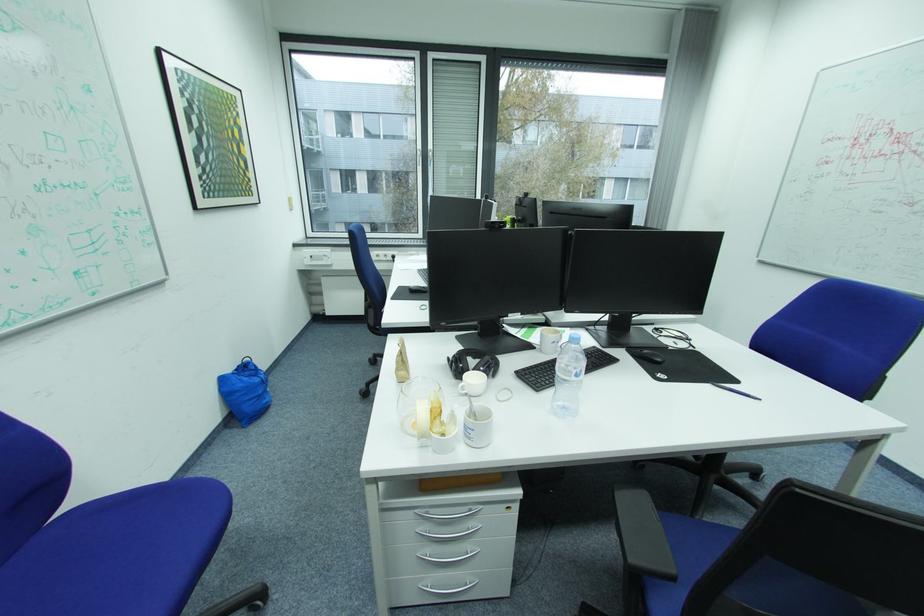
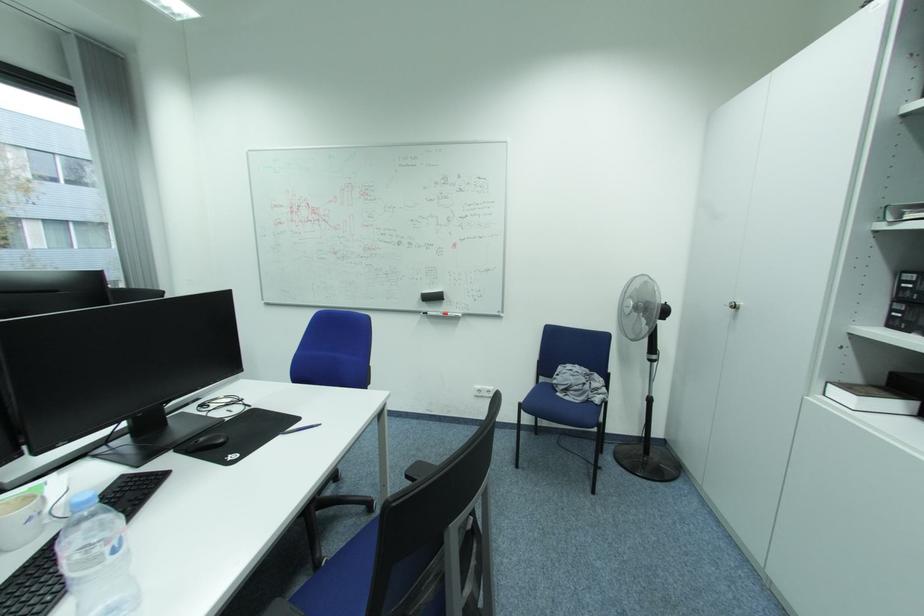
Question: How did the camera likely rotate?

Choices:
 (A) Left
 (B) Right
 (C) Up
 (D) Down

Answer: (B)